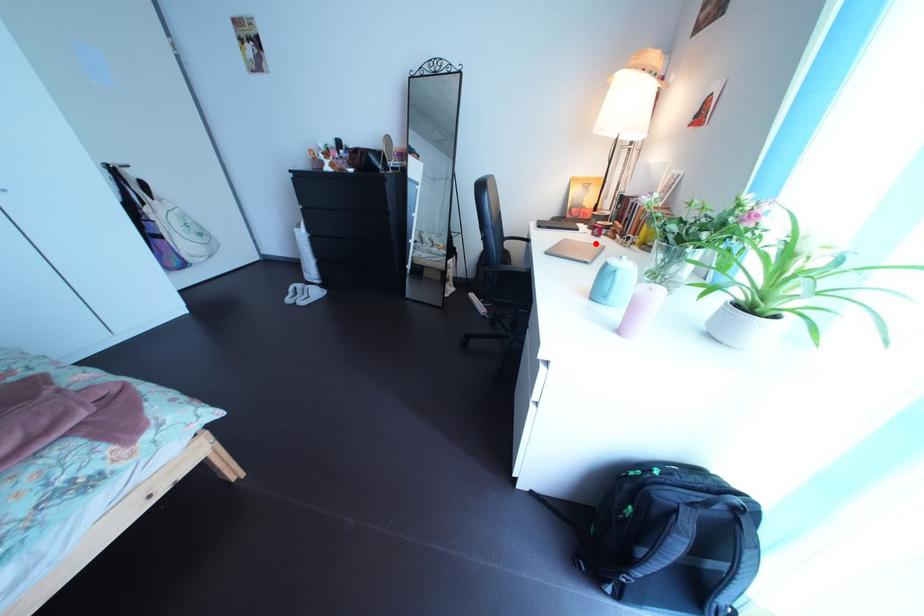
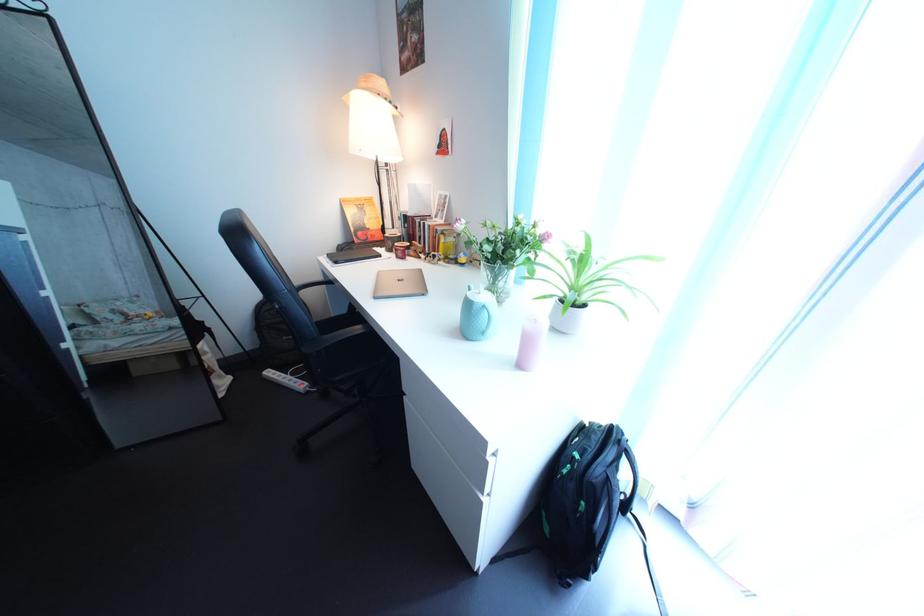
Locate, in the second image, the point that corresponds to the highlighted location in the first image.

(402, 269)